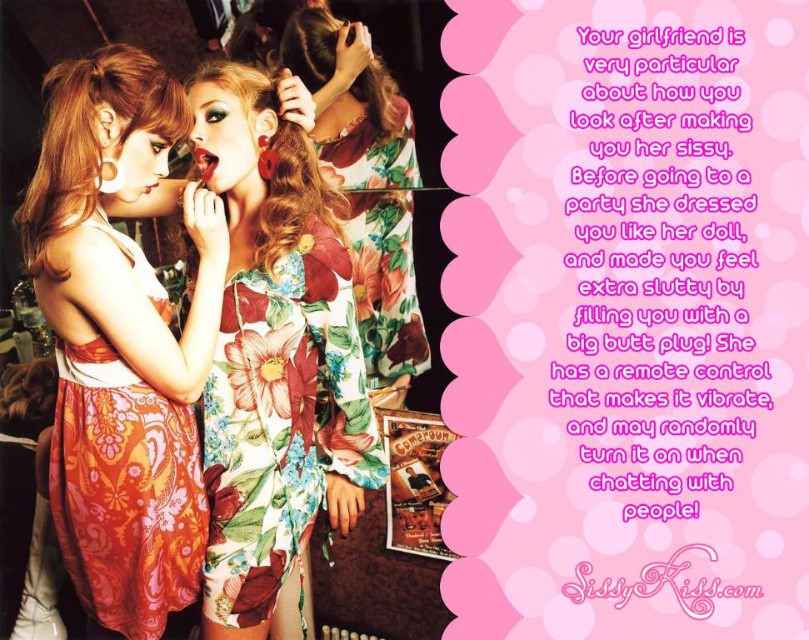
This screenshot has width=809, height=640. I want to click on fluffy floral dress at center, so click(x=293, y=195).

Who is taller, fluffy floral dress at center or curly brown hair at upper center?

fluffy floral dress at center

Which is in front, point (287, 124) or point (373, 115)?

Point (287, 124) is more forward.

Identify the location of fluffy floral dress at center. (293, 195).

Which is below, matte floral dress at center or floral-patterned fabric dress at center?

matte floral dress at center is below.

Which is in front, point (129, 288) or point (324, 138)?

Point (129, 288) is more forward.

Describe the element at coordinates (121, 339) in the screenshot. I see `matte floral dress at center` at that location.

Find the location of a particular element. matte floral dress at center is located at coordinates (121, 339).

Who is more distant from viewer, (129, 193) or (64, 80)?

The point (129, 193) is behind.

Is matte floral dress at center shorter than blonde silky hair at left?

No, matte floral dress at center is not shorter than blonde silky hair at left.

Which is behind, point (159, 456) or point (111, 99)?

The point (159, 456) is behind.

Where is `matte floral dress at center`? This screenshot has height=640, width=809. matte floral dress at center is located at coordinates (121, 339).